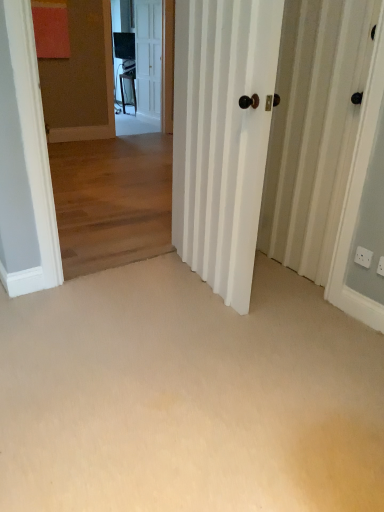
Question: Relative to wooden floor at center, the 1th corridor when ordered from top to bottom, is white plastic electric outlet at lower right, positioned as the first electric outlet in back-to-front order, in front or behind?

Choices:
 (A) front
 (B) behind

Answer: (B)

Question: Is white plastic electric outlet at lower right, arranged as the second electric outlet when viewed from the right, spatially inside wooden floor at center, acting as the 2th corridor starting from the bottom, or outside of it?

Choices:
 (A) inside
 (B) outside

Answer: (B)

Question: Estimate the real-world distances between objects in this image. Which object is closer to the white plastic electric outlet at lower right, arranged as the second electric outlet when viewed from the right?

Choices:
 (A) white glossy screen door at upper center
 (B) wooden floor at center, acting as the 2th corridor starting from the bottom
 (C) white glossy door at center, marked as the first door in a front-to-back arrangement
 (D) white plastic electric outlet at lower right, the first electric outlet viewed from the front
 (E) white wooden door at upper center, which ranks as the 2th door in front-to-back order

Answer: (D)

Question: Which is farther from the white glossy screen door at upper center?

Choices:
 (A) wooden floor at center, the 1th corridor when ordered from top to bottom
 (B) white wooden door at upper center, arranged as the first door when viewed from the top
 (C) beige carpet at center, which appears as the first corridor when ordered from the bottom
 (D) white plastic electric outlet at lower right, the first electric outlet viewed from the front
 (E) white glossy door at center, marked as the first door in a front-to-back arrangement

Answer: (D)